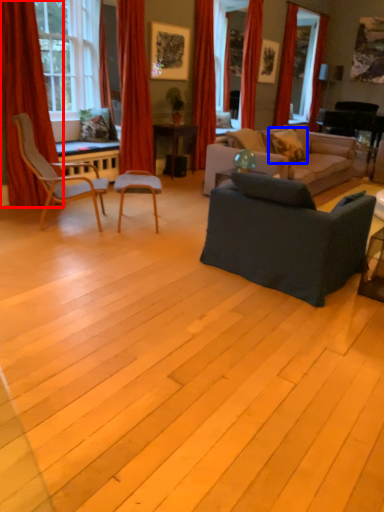
Question: Which of the following is the farthest to the observer, curtain (highlighted by a red box) or pillow (highlighted by a blue box)?

Choices:
 (A) curtain
 (B) pillow

Answer: (B)